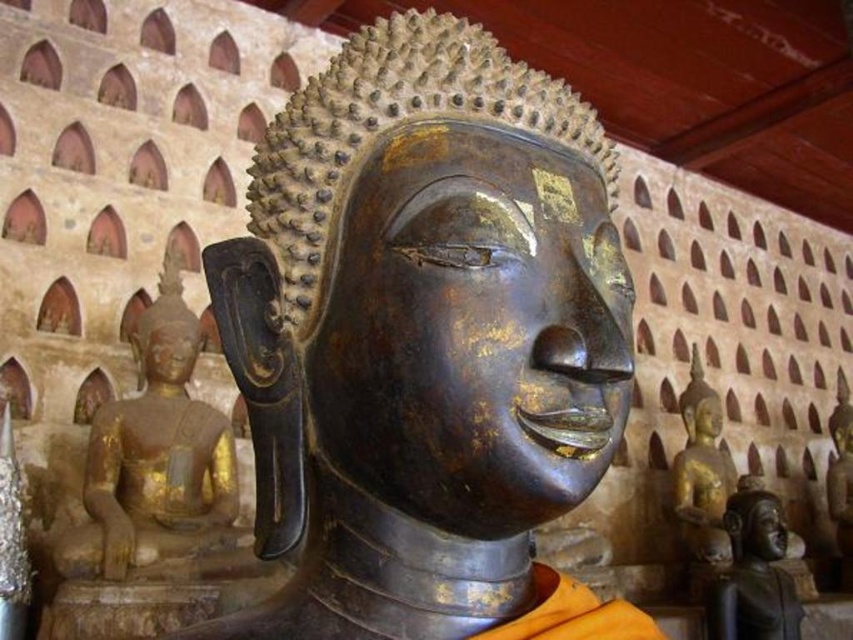
Question: Observing the image, what is the correct spatial positioning of gold leaf statue at center in reference to gold/gilded statue at center?

Choices:
 (A) left
 (B) right

Answer: (A)

Question: Is bronze statue at lower right wider than bronze statue head at center?

Choices:
 (A) yes
 (B) no

Answer: (A)

Question: Which object is the closest to the bronze statue at center?

Choices:
 (A) gold/gilded statue at center
 (B) gold leaf statue at center
 (C) bronze statue head at center
 (D) gold polished statue at center

Answer: (B)

Question: In this image, where is bronze statue head at center located relative to gold polished statue at center?

Choices:
 (A) below
 (B) above

Answer: (A)

Question: Which of these objects is positioned farthest from the bronze statue head at center?

Choices:
 (A) gold leaf statue at center
 (B) gold polished statue at center

Answer: (A)

Question: Which object appears farthest from the camera in this image?

Choices:
 (A) bronze statue at lower right
 (B) bronze statue at center
 (C) gold/gilded statue at center

Answer: (C)